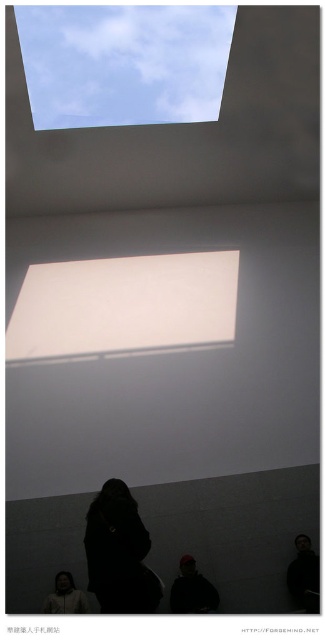
Can you confirm if transparent glass window at upper center is positioned above black matte person at lower center?

Yes, transparent glass window at upper center is above black matte person at lower center.

Which is more to the right, transparent glass window at upper center or black matte person at lower center?

From the viewer's perspective, transparent glass window at upper center appears more on the right side.

Who is more forward, (225, 38) or (119, 589)?

Point (119, 589)

I want to click on transparent glass window at upper center, so click(x=124, y=61).

Is white matte rectangular at upper center smaller than dark hair at lower right?

Actually, white matte rectangular at upper center might be larger than dark hair at lower right.

Does white matte rectangular at upper center have a larger size compared to dark hair at lower right?

Yes.

What do you see at coordinates (124, 305) in the screenshot? I see `white matte rectangular at upper center` at bounding box center [124, 305].

Identify the location of white matte rectangular at upper center. The image size is (325, 640). (124, 305).

Who is taller, white matte rectangular at upper center or black matte person at lower center?

white matte rectangular at upper center is taller.

Is white matte rectangular at upper center thinner than black matte person at lower center?

In fact, white matte rectangular at upper center might be wider than black matte person at lower center.

Find the location of a particular element. The height and width of the screenshot is (640, 325). white matte rectangular at upper center is located at coordinates (124, 305).